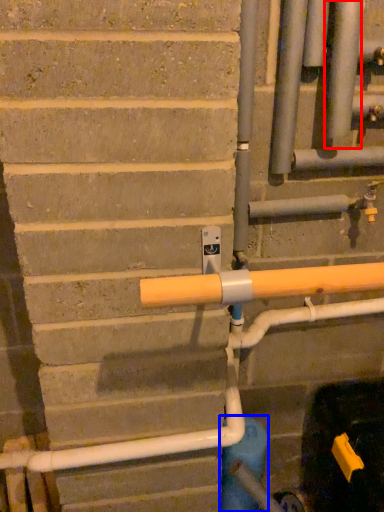
Question: Which of the following is the farthest to the observer, pipe (highlighted by a red box) or water pipe (highlighted by a blue box)?

Choices:
 (A) pipe
 (B) water pipe

Answer: (B)